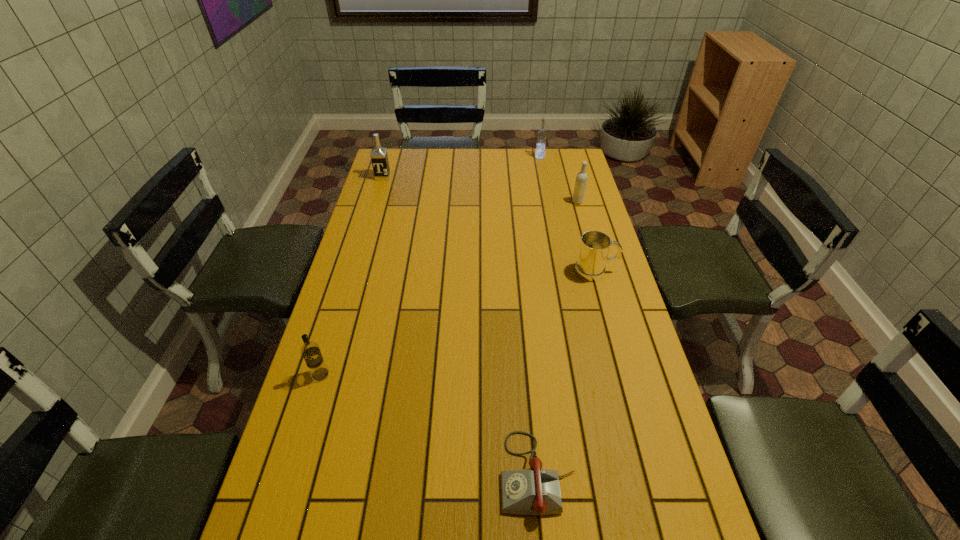
Identify the location of vacant space located 0.350m on the front label of the fifth nearest object. (366, 232).

Where is `blank space located on the front of the farthest vodka`? Image resolution: width=960 pixels, height=540 pixels. blank space located on the front of the farthest vodka is located at coordinates (547, 197).

Locate an element on the screen. This screenshot has width=960, height=540. free space located 0.380m on the front of the second nearest vodka is located at coordinates (596, 272).

The image size is (960, 540). I want to click on vacant space located 0.340m on the label of the nearest vodka, so click(275, 525).

Where is `vacant position located 0.250m on the dial of the fourth object from right to left`? The image size is (960, 540). vacant position located 0.250m on the dial of the fourth object from right to left is located at coordinates (389, 474).

The width and height of the screenshot is (960, 540). I want to click on vacant space located 0.310m on the dial of the fourth object from right to left, so click(x=362, y=474).

The height and width of the screenshot is (540, 960). In order to click on vacant space located 0.150m on the dial of the fourth object from right to left in this screenshot , I will do `click(433, 474)`.

The image size is (960, 540). Identify the location of mug that is at the right edge. (590, 266).

In order to click on object that is at the far left corner in this screenshot , I will do `click(379, 157)`.

At what (x,y) coordinates should I click in order to perform the action: click on object that is at the far right corner. Please return your answer as a coordinate pair (x, y). This screenshot has height=540, width=960. Looking at the image, I should click on (542, 134).